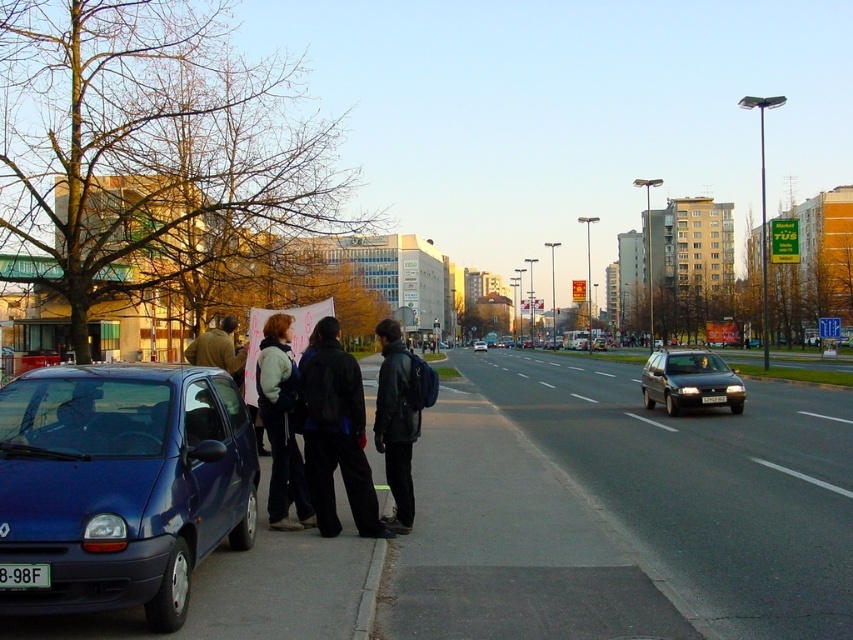
How distant is black plastic license plate at lower left from black plastic license plate at lower center?

black plastic license plate at lower left is 16.05 meters from black plastic license plate at lower center.

Between black plastic license plate at lower left and black plastic license plate at lower center, which one has more height?

With more height is black plastic license plate at lower center.

Which is in front, point (20, 573) or point (711, 400)?

Point (20, 573)

Locate an element on the screen. The height and width of the screenshot is (640, 853). black plastic license plate at lower left is located at coordinates (24, 576).

Measure the distance between point (33, 577) and camera.

14.16 feet

Is the position of black plastic license plate at lower left less distant than that of matte black sedan at center?

Yes.

What are the coordinates of `black plastic license plate at lower left` in the screenshot? It's located at (24, 576).

Which is in front, point (618, 364) or point (387, 403)?

Point (387, 403)

Does point (664, 440) lie in front of point (379, 324)?

No.

Locate an element on the screen. This screenshot has width=853, height=640. black asphalt pavement at lower right is located at coordinates (703, 484).